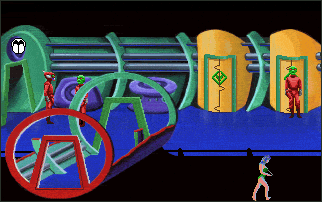
Locate an element on the screen. Image resolution: width=322 pixels, height=202 pixels. entrance is located at coordinates (17, 88).